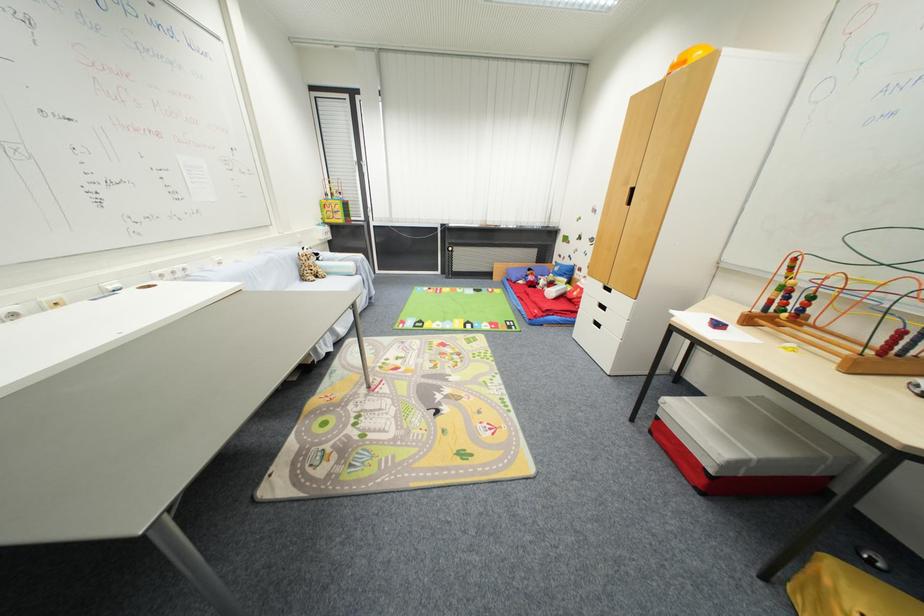
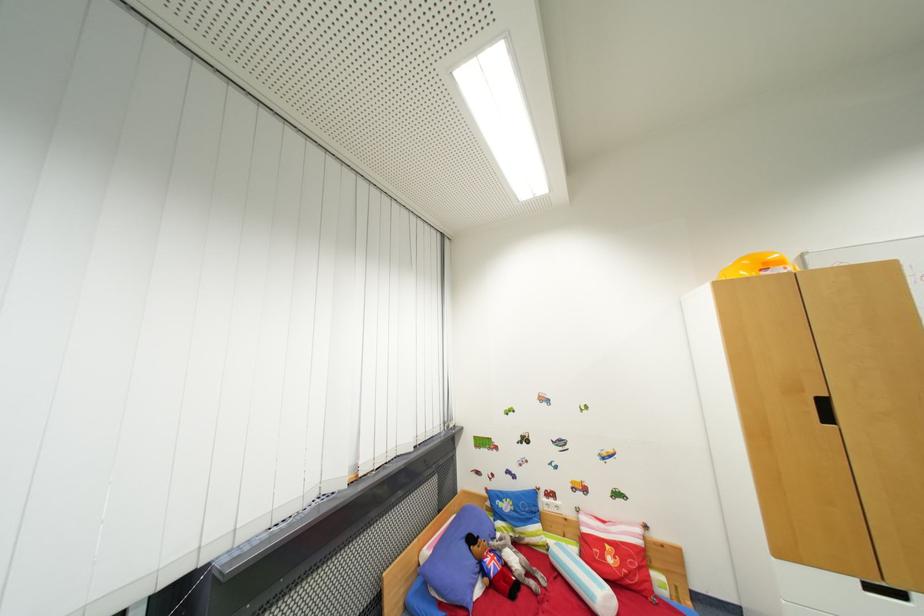
Locate, in the second image, the point that corresponds to the point at 535,272 in the first image.

(477, 541)